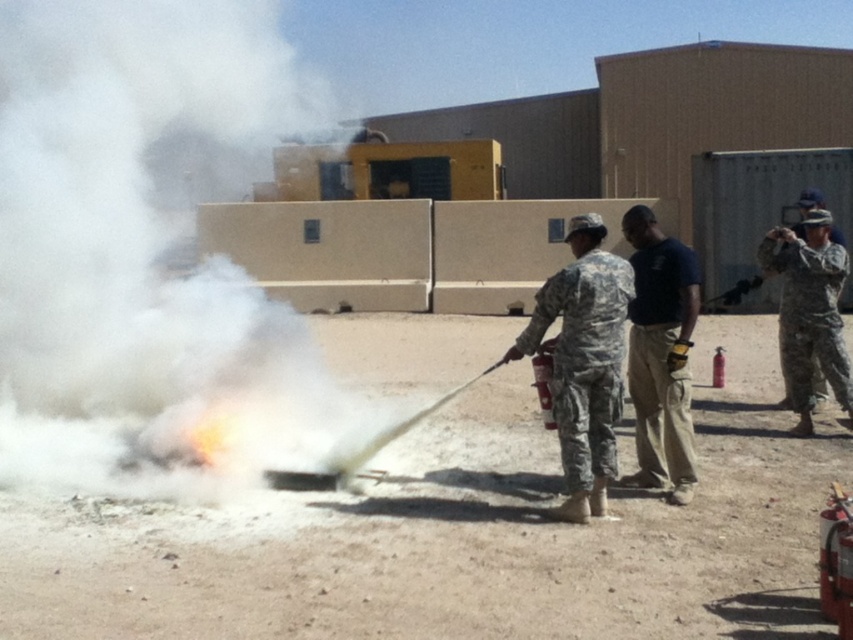
Between dark blue t-shirt at center and camouflage uniform at right, which one appears on the left side from the viewer's perspective?

dark blue t-shirt at center is more to the left.

Is dark blue t-shirt at center in front of camouflage uniform at right?

Yes, dark blue t-shirt at center is in front of camouflage uniform at right.

Does point (645, 275) lie behind point (804, 224)?

No, it is not.

Where is `dark blue t-shirt at center`? dark blue t-shirt at center is located at coordinates (660, 355).

Between camouflage uniform at center and dark blue t-shirt at center, which one appears on the right side from the viewer's perspective?

dark blue t-shirt at center is more to the right.

Who is taller, camouflage uniform at center or dark blue t-shirt at center?

dark blue t-shirt at center is taller.

You are a GUI agent. You are given a task and a screenshot of the screen. Output one action in this format:
    pyautogui.click(x=<x>, y=<y>)
    Task: Click on the camouflage uniform at center
    The height and width of the screenshot is (640, 853).
    Given the screenshot: What is the action you would take?
    pyautogui.click(x=583, y=362)

Is camouflage uniform at center to the right of camouflage uniform at right from the viewer's perspective?

No, camouflage uniform at center is not to the right of camouflage uniform at right.

Between camouflage uniform at center and camouflage uniform at right, which one appears on the right side from the viewer's perspective?

Positioned to the right is camouflage uniform at right.

In order to click on camouflage uniform at center in this screenshot , I will do `click(583, 362)`.